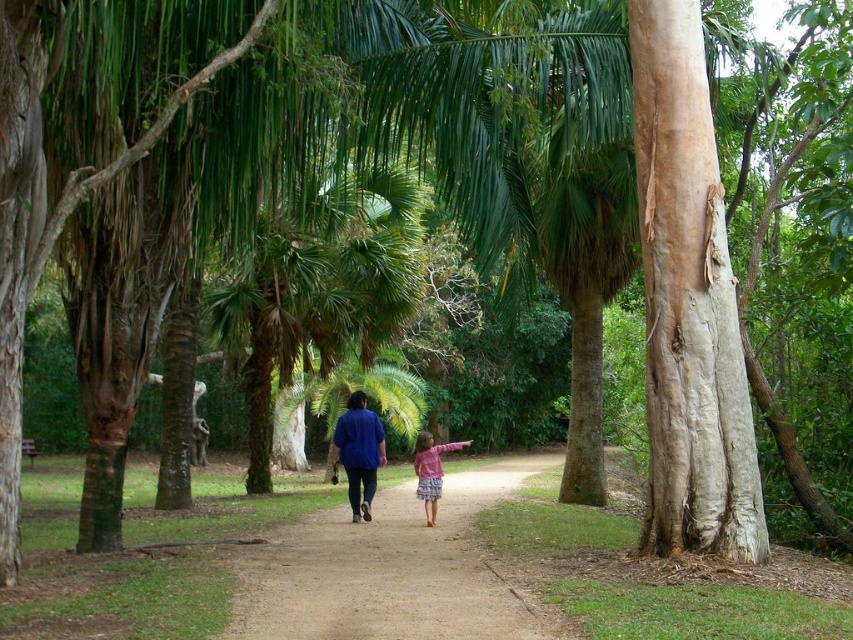
Does point (351, 595) lie behind point (352, 477)?

That is False.

Who is shorter, dirt path at center or blue cotton shirt at center?

With less height is blue cotton shirt at center.

Which is behind, point (297, 600) or point (340, 454)?

The point (340, 454) is more distant.

Identify the location of dirt path at center. (387, 570).

Is dirt path at center taller than pink fabric dress at center?

In fact, dirt path at center may be shorter than pink fabric dress at center.

You are a GUI agent. You are given a task and a screenshot of the screen. Output one action in this format:
    pyautogui.click(x=<x>, y=<y>)
    Task: Click on the dirt path at center
    This screenshot has height=640, width=853.
    Given the screenshot: What is the action you would take?
    pyautogui.click(x=387, y=570)

Is point (467, 589) behind point (432, 515)?

No, (467, 589) is in front of (432, 515).

Locate an element on the screen. This screenshot has width=853, height=640. dirt path at center is located at coordinates (387, 570).

Is blue cotton shirt at center taller than pink fabric dress at center?

No.

Does point (345, 438) come farther from viewer compared to point (424, 467)?

That is True.

Between point (364, 403) and point (427, 481), which one is positioned in front?

Positioned in front is point (427, 481).

Find the location of a particular element. blue cotton shirt at center is located at coordinates (358, 452).